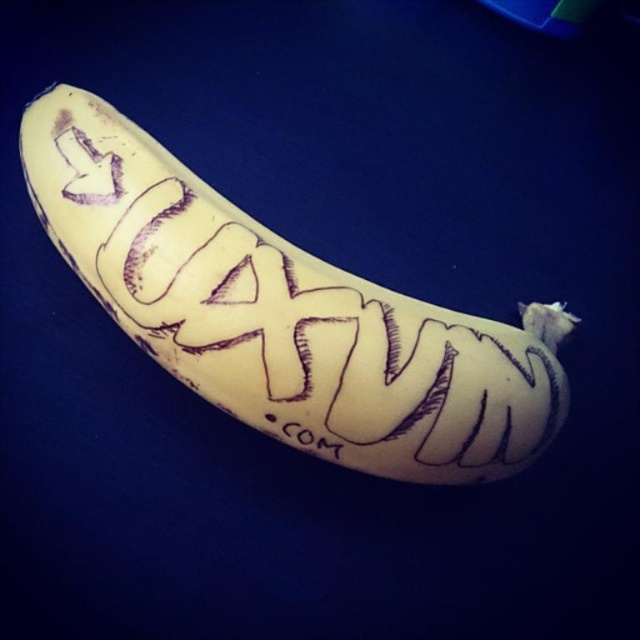
You are an artist trying to paint this scene. You notice the yellow matte banana at center and the black ink text at center. Which object should you paint first if you want to follow the proper layering technique to ensure the text remains visible?

The yellow matte banana at center is positioned over the black ink text at center, so you should paint the black ink text at center first to ensure it remains visible underneath the banana.

You are an artist trying to paint the scene. You need to place the yellow matte banana at center and the black ink text at center in your painting. According to the image, which object should be positioned to the right side?

The black ink text at center should be positioned to the right side because the yellow matte banana at center is to the left of black ink text at center.